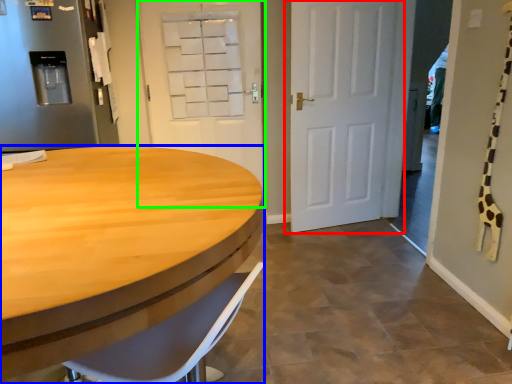
Question: Estimate the real-world distances between objects in this image. Which object is closer to door (highlighted by a red box), desk (highlighted by a blue box) or door (highlighted by a green box)?

Choices:
 (A) desk
 (B) door

Answer: (B)